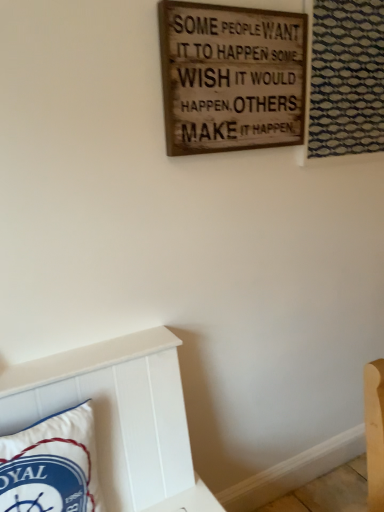
Question: Is blue textured fabric at upper right not within wooden signboard at upper center?

Choices:
 (A) yes
 (B) no

Answer: (A)

Question: From the image's perspective, is blue textured fabric at upper right above wooden signboard at upper center?

Choices:
 (A) no
 (B) yes

Answer: (B)

Question: Can you confirm if blue textured fabric at upper right is positioned to the right of wooden signboard at upper center?

Choices:
 (A) no
 (B) yes

Answer: (B)

Question: Does blue textured fabric at upper right contain wooden signboard at upper center?

Choices:
 (A) yes
 (B) no

Answer: (B)

Question: Is blue textured fabric at upper right oriented towards wooden signboard at upper center?

Choices:
 (A) no
 (B) yes

Answer: (A)

Question: Is wooden signboard at upper center taller or shorter than blue textured fabric at upper right?

Choices:
 (A) tall
 (B) short

Answer: (B)

Question: From the image's perspective, is wooden signboard at upper center above or below blue textured fabric at upper right?

Choices:
 (A) above
 (B) below

Answer: (B)

Question: From a real-world perspective, is wooden signboard at upper center physically located above or below blue textured fabric at upper right?

Choices:
 (A) below
 (B) above

Answer: (A)

Question: Is point (286, 81) positioned closer to the camera than point (354, 66)?

Choices:
 (A) farther
 (B) closer

Answer: (B)

Question: Is blue textured fabric at upper right wider or thinner than wooden signboard at upper center?

Choices:
 (A) wide
 (B) thin

Answer: (A)

Question: Is blue textured fabric at upper right to the left or to the right of wooden signboard at upper center in the image?

Choices:
 (A) right
 (B) left

Answer: (A)

Question: Is blue textured fabric at upper right in front of or behind wooden signboard at upper center in the image?

Choices:
 (A) behind
 (B) front

Answer: (A)

Question: Based on their sizes in the image, would you say blue textured fabric at upper right is bigger or smaller than wooden signboard at upper center?

Choices:
 (A) big
 (B) small

Answer: (A)

Question: Considering the positions of white fabric pillow at lower left and blue textured fabric at upper right in the image, is white fabric pillow at lower left bigger or smaller than blue textured fabric at upper right?

Choices:
 (A) small
 (B) big

Answer: (B)

Question: From the image's perspective, is white fabric pillow at lower left located above or below blue textured fabric at upper right?

Choices:
 (A) below
 (B) above

Answer: (A)